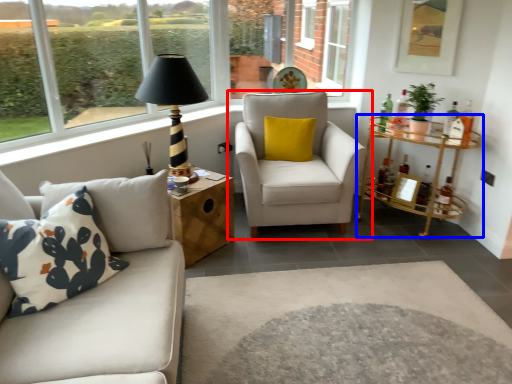
Question: Among these objects, which one is farthest to the camera, chair (highlighted by a red box) or table (highlighted by a blue box)?

Choices:
 (A) chair
 (B) table

Answer: (B)